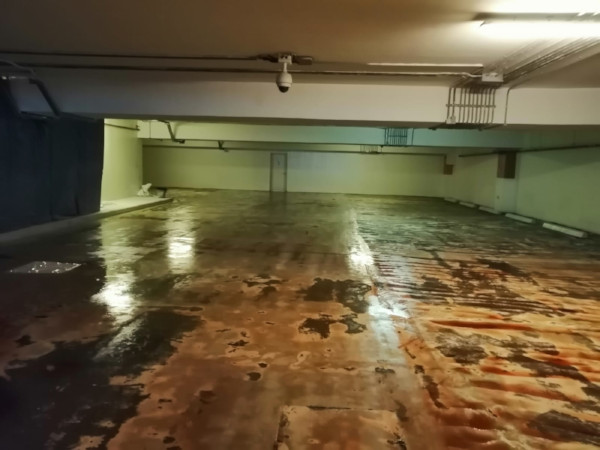
Identify the location of bright white light. Image resolution: width=600 pixels, height=450 pixels. (538, 32).